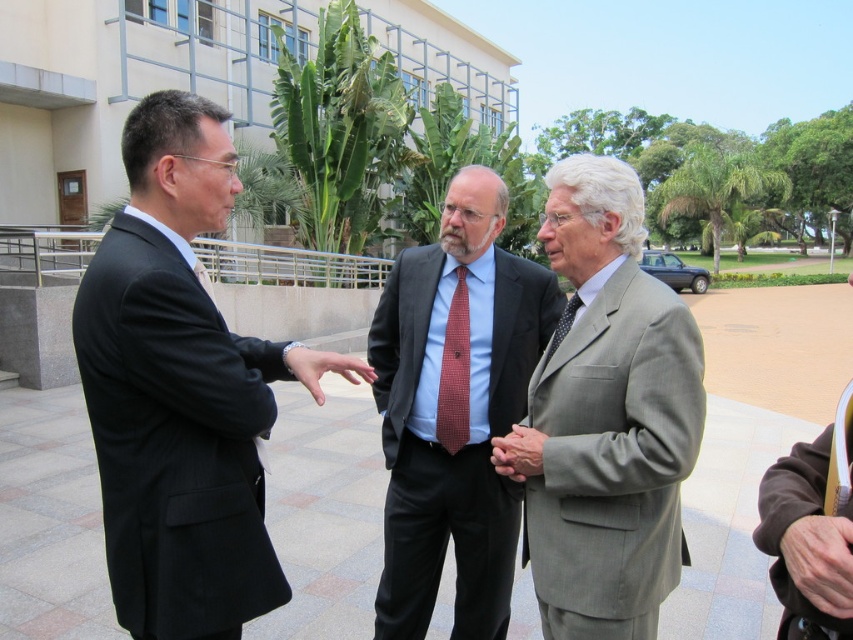
Looking at this image, how far apart are black suit at left and gray wool suit at center?

black suit at left is 38.03 inches away from gray wool suit at center.

Can you confirm if black suit at left is positioned to the left of gray wool suit at center?

Indeed, black suit at left is positioned on the left side of gray wool suit at center.

Between point (209, 465) and point (648, 547), which one is positioned behind?

The point (648, 547) is behind.

I want to click on black suit at left, so click(177, 390).

Does point (461, 445) come behind point (369, 374)?

That is True.

Which is more to the left, red dotted fabric tie at center or smooth skin hand at center?

smooth skin hand at center is more to the left.

Which is in front, point (450, 448) or point (302, 353)?

Point (302, 353) is in front.

Where is `red dotted fabric tie at center`? red dotted fabric tie at center is located at coordinates (454, 371).

Who is more forward, (645,337) or (799,557)?

Positioned in front is point (799,557).

Who is shorter, gray wool suit at center or leather hand at center?

With less height is leather hand at center.

Is point (672, 426) positioned behind point (798, 579)?

Yes, it is.

This screenshot has height=640, width=853. What are the coordinates of `gray wool suit at center` in the screenshot? It's located at (608, 417).